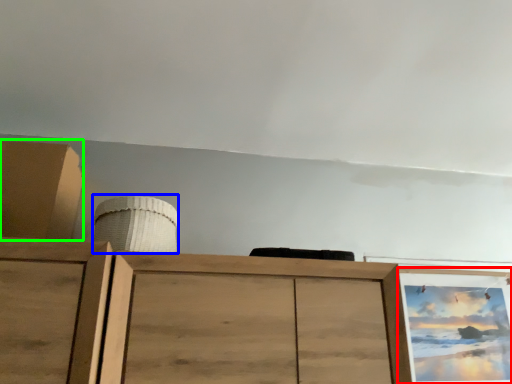
Question: Which is nearer to the picture frame (highlighted by a red box)? job (highlighted by a blue box) or cabinetry (highlighted by a green box).

Choices:
 (A) job
 (B) cabinetry

Answer: (A)